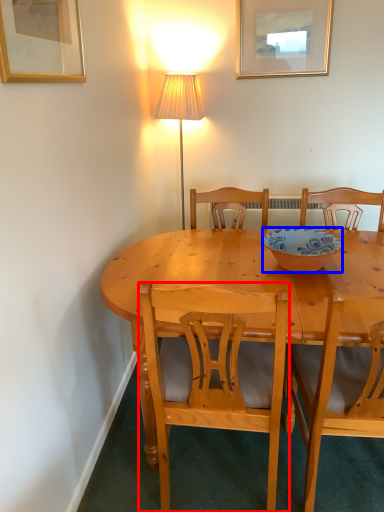
Question: Which object is further to the camera taking this photo, chair (highlighted by a red box) or bowl (highlighted by a blue box)?

Choices:
 (A) chair
 (B) bowl

Answer: (B)